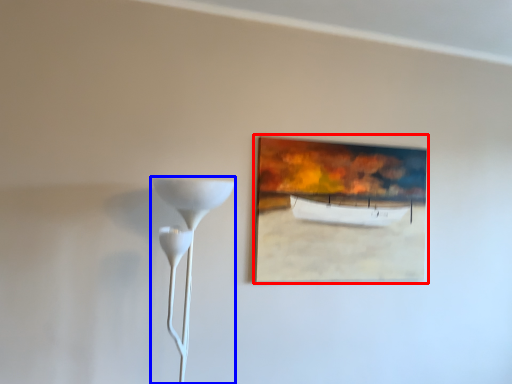
Question: Which point is further to the camera, picture frame (highlighted by a red box) or lamp (highlighted by a blue box)?

Choices:
 (A) picture frame
 (B) lamp

Answer: (A)